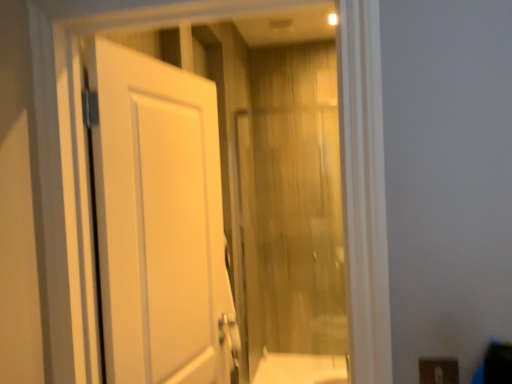
Question: Considering the relative sizes of translucent wood curtain at center and white matte door at left in the image provided, is translucent wood curtain at center bigger than white matte door at left?

Choices:
 (A) no
 (B) yes

Answer: (A)

Question: Considering the relative sizes of translucent wood curtain at center and white matte door at left in the image provided, is translucent wood curtain at center taller than white matte door at left?

Choices:
 (A) no
 (B) yes

Answer: (B)

Question: Does translucent wood curtain at center have a smaller size compared to white matte door at left?

Choices:
 (A) no
 (B) yes

Answer: (B)

Question: Is translucent wood curtain at center touching white matte door at left?

Choices:
 (A) no
 (B) yes

Answer: (A)

Question: From a real-world perspective, is translucent wood curtain at center physically below white matte door at left?

Choices:
 (A) no
 (B) yes

Answer: (B)

Question: Considering the relative positions of brown matte electric outlet at lower right and translucent wood curtain at center in the image provided, is brown matte electric outlet at lower right to the left or to the right of translucent wood curtain at center?

Choices:
 (A) right
 (B) left

Answer: (A)

Question: Is point (454, 372) positioned closer to the camera than point (288, 66)?

Choices:
 (A) closer
 (B) farther

Answer: (A)

Question: Based on their sizes in the image, would you say brown matte electric outlet at lower right is bigger or smaller than translucent wood curtain at center?

Choices:
 (A) small
 (B) big

Answer: (A)

Question: Relative to translucent wood curtain at center, is brown matte electric outlet at lower right in front or behind?

Choices:
 (A) front
 (B) behind

Answer: (A)

Question: Is white matte door at left to the left or to the right of brown matte electric outlet at lower right in the image?

Choices:
 (A) right
 (B) left

Answer: (B)

Question: In terms of size, does white matte door at left appear bigger or smaller than brown matte electric outlet at lower right?

Choices:
 (A) big
 (B) small

Answer: (A)

Question: Relative to brown matte electric outlet at lower right, is white matte door at left in front or behind?

Choices:
 (A) behind
 (B) front

Answer: (A)

Question: In terms of height, does white matte door at left look taller or shorter compared to brown matte electric outlet at lower right?

Choices:
 (A) short
 (B) tall

Answer: (B)

Question: From the image's perspective, is translucent wood curtain at center positioned above or below brown matte electric outlet at lower right?

Choices:
 (A) above
 (B) below

Answer: (A)

Question: Based on their sizes in the image, would you say translucent wood curtain at center is bigger or smaller than brown matte electric outlet at lower right?

Choices:
 (A) big
 (B) small

Answer: (A)